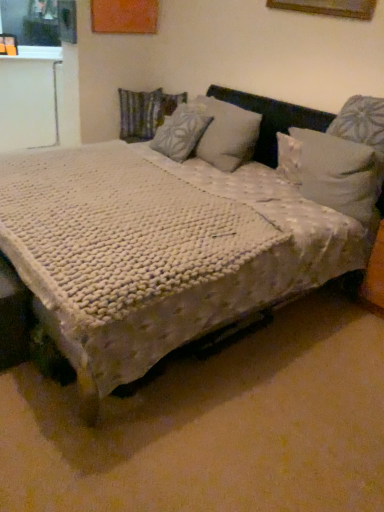
Question: Would you say white textured blanket at center is inside or outside white soft pillow at upper right, placed as the 3th pillow when sorted from back to front?

Choices:
 (A) inside
 (B) outside

Answer: (B)

Question: Does point (142, 349) appear closer or farther from the camera than point (334, 167)?

Choices:
 (A) closer
 (B) farther

Answer: (A)

Question: Which is nearer to the white textured pillow at center, acting as the 2th pillow starting from the right?

Choices:
 (A) white soft pillow at upper right, which ranks as the third pillow in left-to-right order
 (B) white textured blanket at center
 (C) white textured blanket at center
 (D) textured fabric pillow at center, which is the 1th pillow from left to right

Answer: (C)

Question: Which is farther from the white textured blanket at center?

Choices:
 (A) white textured pillow at center, the 2th pillow positioned from the front
 (B) textured fabric pillow at center, which appears as the third pillow when viewed from the right
 (C) white soft pillow at upper right, which appears as the 1th pillow when viewed from the front
 (D) white textured blanket at center

Answer: (B)